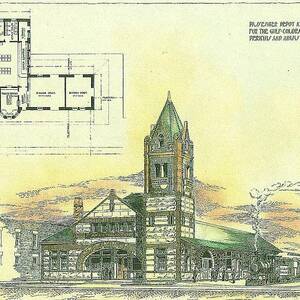
Identify the location of architect drawing of commercial building interior. (42, 98).